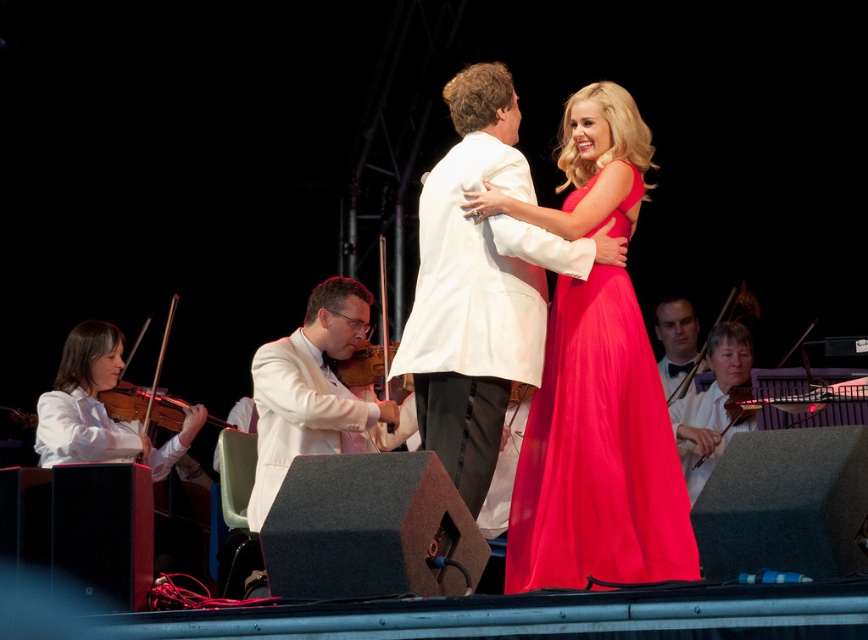
Who is higher up, shiny silk dress at center or wooden violin at lower left?

shiny silk dress at center is higher up.

Does shiny silk dress at center lie in front of wooden violin at lower left?

Yes.

This screenshot has height=640, width=868. Describe the element at coordinates (597, 451) in the screenshot. I see `shiny silk dress at center` at that location.

I want to click on shiny silk dress at center, so click(597, 451).

Is point (64, 387) more distant than point (718, 317)?

No.

Is white smooth violin at lower left closer to camera compared to wooden violin at lower right?

Yes, white smooth violin at lower left is in front of wooden violin at lower right.

Where is `white smooth violin at lower left`? Image resolution: width=868 pixels, height=640 pixels. white smooth violin at lower left is located at coordinates (99, 408).

Locate an element on the screen. The height and width of the screenshot is (640, 868). white smooth violin at lower left is located at coordinates (99, 408).

Is white smooth violin at lower left thinner than wooden violin at lower left?

No.

Is point (83, 454) behind point (141, 388)?

No, it is not.

Where is `white smooth violin at lower left`? The height and width of the screenshot is (640, 868). white smooth violin at lower left is located at coordinates (99, 408).